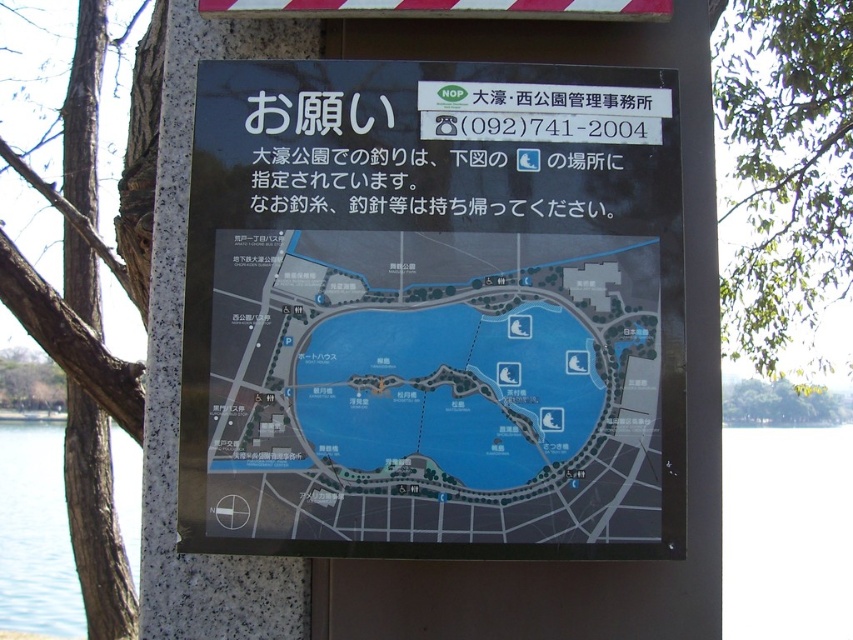
You are holding a camera and standing in front of the signboard. You want to take a photo of the blue paper map at center without any obstructions. Is the camera close enough to capture the map clearly?

The blue paper map at center and camera are 6.22 feet apart from each other. Since this distance is within the typical focusing range of most cameras, the camera is close enough to capture the map clearly.

You are looking at a signboard in a park. The signboard has a blue paper map at center and a transparent water at lower left. Which object is covering the other?

The blue paper map at center is positioned over transparent water at lower left, so the blue paper map at center is covering the transparent water at lower left.

You want to compare the sizes of the blue paper map at center and the transparent water at lower left. Which one is wider?

The blue paper map at center is wider than transparent water at lower left because its width is larger than the transparent water at lower left.